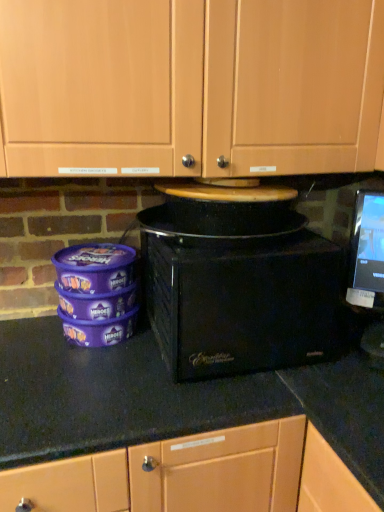
Question: From a real-world perspective, is wooden cabinet doors at upper center positioned above or below black plastic microwave at center?

Choices:
 (A) below
 (B) above

Answer: (B)

Question: Considering the positions of wooden cabinet doors at upper center and black plastic microwave at center in the image, is wooden cabinet doors at upper center bigger or smaller than black plastic microwave at center?

Choices:
 (A) big
 (B) small

Answer: (A)

Question: Relative to black plastic microwave at center, is wooden cabinet doors at upper center in front or behind?

Choices:
 (A) behind
 (B) front

Answer: (B)

Question: Is black plastic microwave at center spatially inside wooden cabinet doors at upper center, or outside of it?

Choices:
 (A) inside
 (B) outside

Answer: (B)

Question: In terms of size, does black plastic microwave at center appear bigger or smaller than wooden cabinet doors at upper center?

Choices:
 (A) big
 (B) small

Answer: (B)

Question: Considering their positions, is black plastic microwave at center located in front of or behind wooden cabinet doors at upper center?

Choices:
 (A) behind
 (B) front

Answer: (A)

Question: From their relative heights in the image, would you say black plastic microwave at center is taller or shorter than wooden cabinet doors at upper center?

Choices:
 (A) tall
 (B) short

Answer: (B)